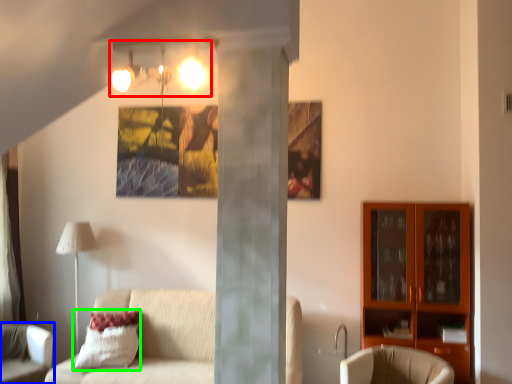
Question: Estimate the real-world distances between objects in this image. Which object is closer to light fixture (highlighted by a red box), chair (highlighted by a blue box) or pillow (highlighted by a green box)?

Choices:
 (A) chair
 (B) pillow

Answer: (B)